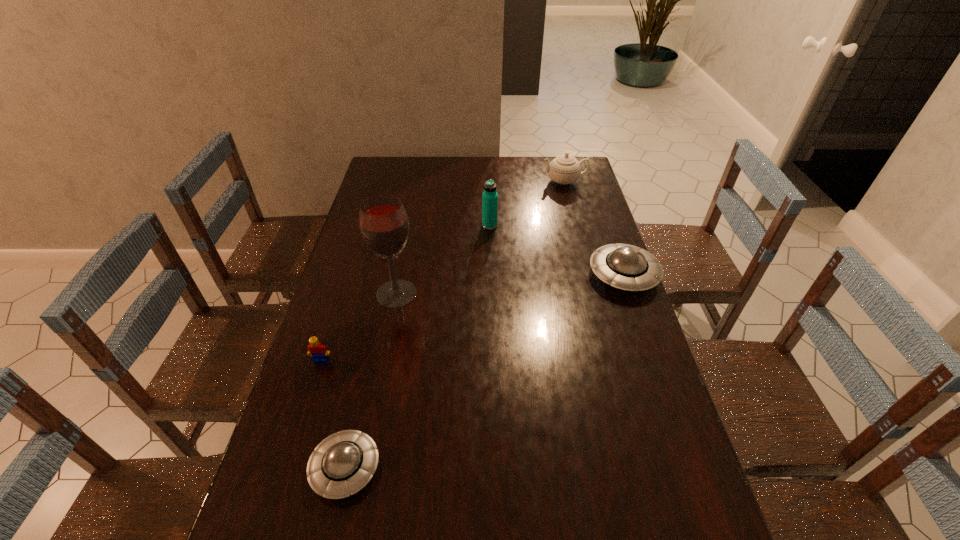
In order to click on location for an additional saucer to make spacing equal in this screenshot , I will do `click(511, 353)`.